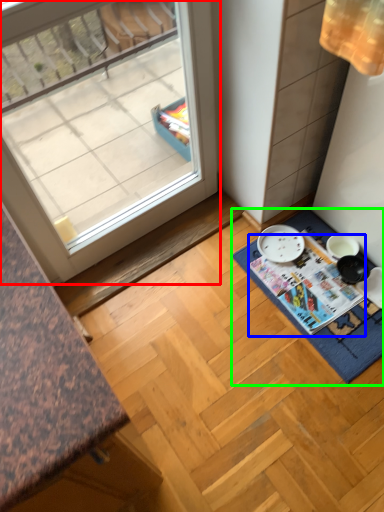
Question: Based on their relative distances, which object is nearer to window (highlighted by a red box)? Choose from magazine (highlighted by a blue box) and bath mat (highlighted by a green box).

Choices:
 (A) magazine
 (B) bath mat

Answer: (A)